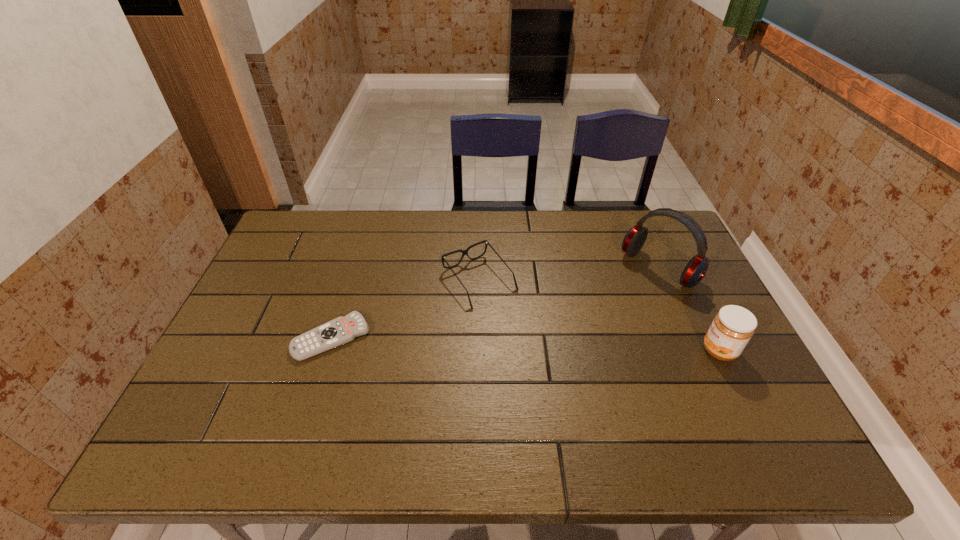
The width and height of the screenshot is (960, 540). I want to click on vacant position in the image that satisfies the following two spatial constraints: 1. on the back side of the spectacles; 2. on the left side of the remote control, so click(349, 281).

Locate an element on the screen. free space that satisfies the following two spatial constraints: 1. on the back side of the earphone; 2. on the right side of the second shortest object is located at coordinates (479, 269).